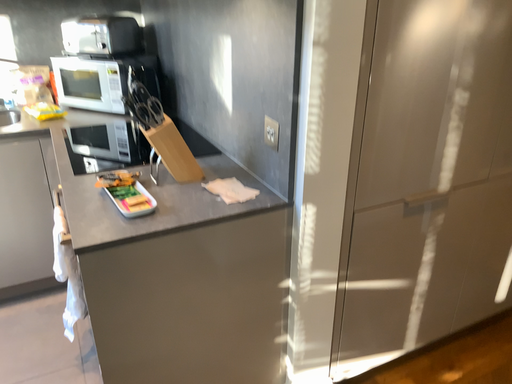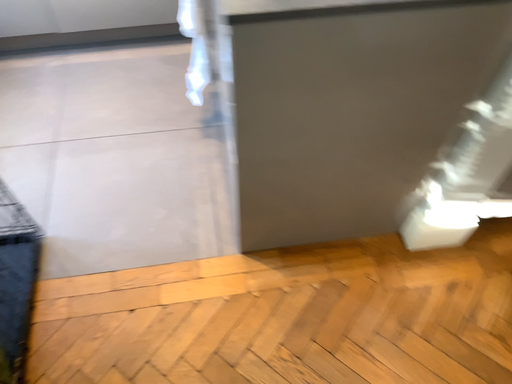
Question: How did the camera likely rotate when shooting the video?

Choices:
 (A) rotated downward
 (B) rotated upward

Answer: (A)